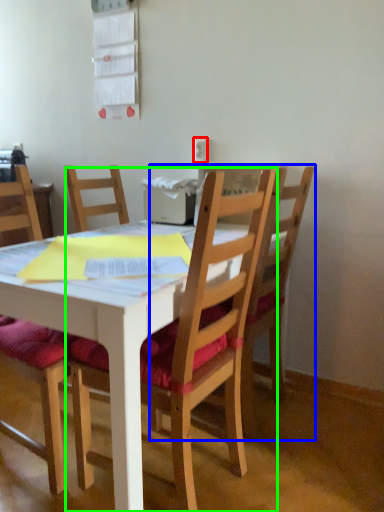
Question: Based on their relative distances, which object is nearer to power outlet (highlighted by a red box)? Choose from chair (highlighted by a blue box) and chair (highlighted by a green box).

Choices:
 (A) chair
 (B) chair

Answer: (A)